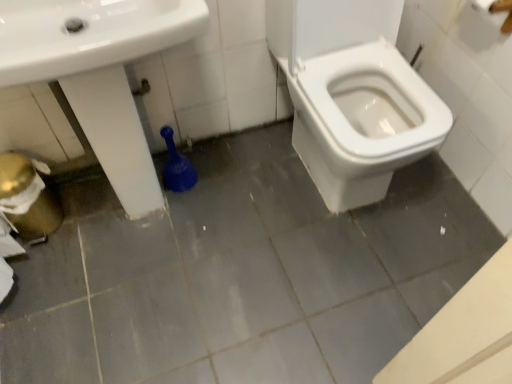
Where is `free space in front of white glossy toilet at center`? free space in front of white glossy toilet at center is located at coordinates (341, 277).